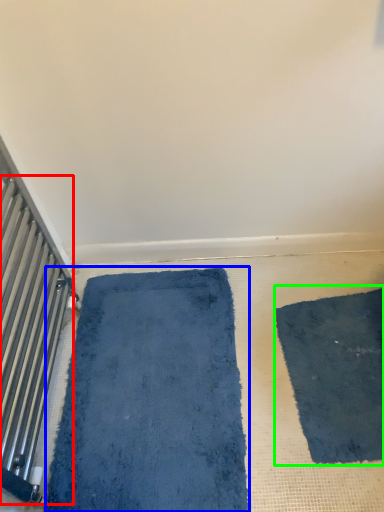
Question: Estimate the real-world distances between objects in this image. Which object is closer to radiator (highlighted by a red box), bath mat (highlighted by a blue box) or mat (highlighted by a green box)?

Choices:
 (A) bath mat
 (B) mat

Answer: (A)